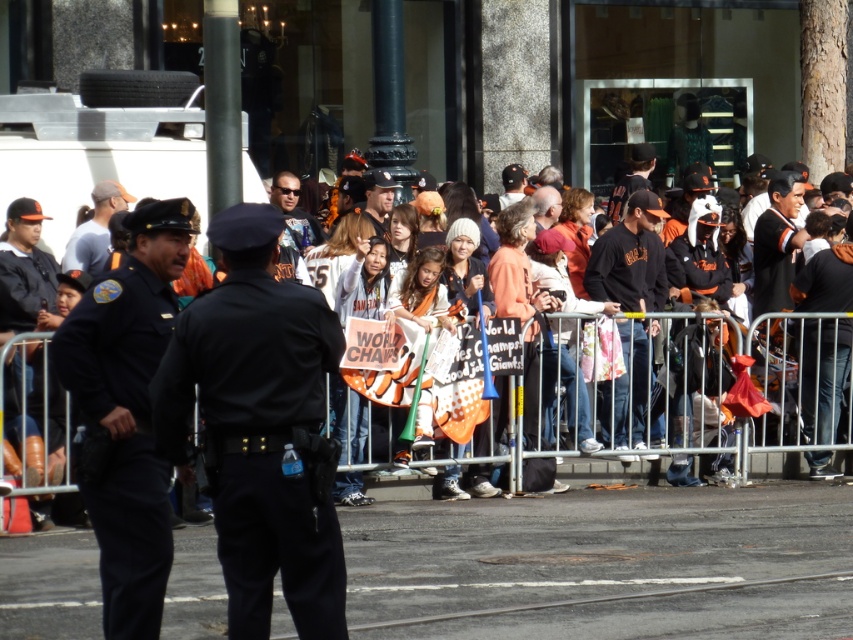
Where is the black uniform at center located in the image?

The black uniform at center is located at point 0.667 on the x axis and 0.304 on the y axis.